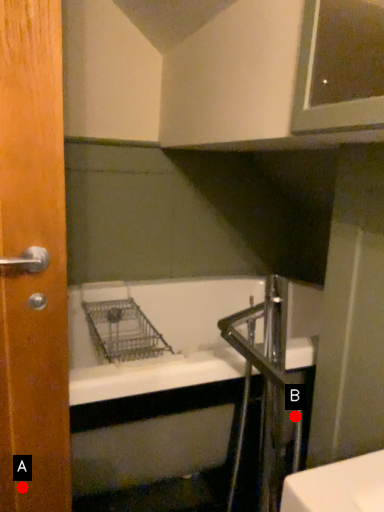
Question: Two points are circled on the image, labeled by A and B beside each circle. Which point is farther from the camera taking this photo?

Choices:
 (A) A is further
 (B) B is further

Answer: (B)